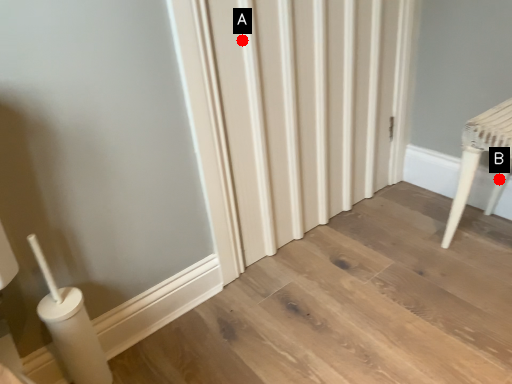
Question: Two points are circled on the image, labeled by A and B beside each circle. Which of the following is the closest to the observer?

Choices:
 (A) A is closer
 (B) B is closer

Answer: (A)